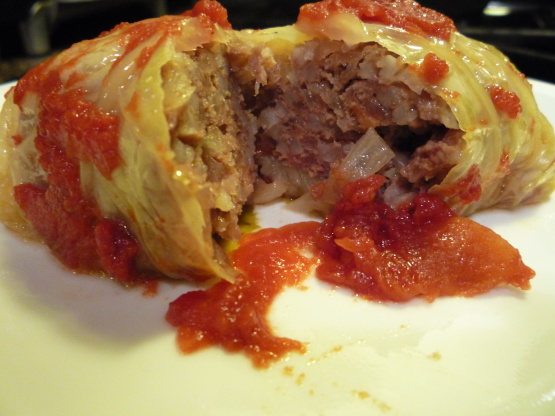
Identify the location of ceramic plate. (415, 343), (130, 367), (60, 316), (549, 98), (539, 219), (276, 223).